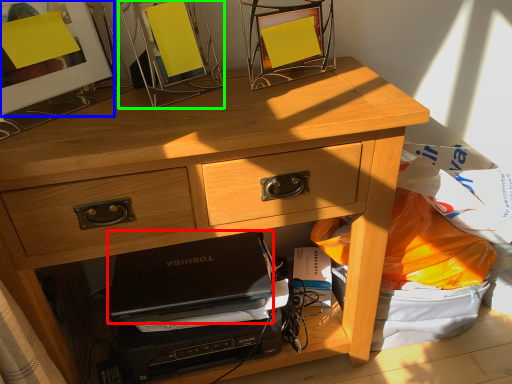
Question: Considering the real-world distances, which object is farthest from laptop (highlighted by a red box)? picture frame (highlighted by a blue box) or picture frame (highlighted by a green box)?

Choices:
 (A) picture frame
 (B) picture frame

Answer: (A)